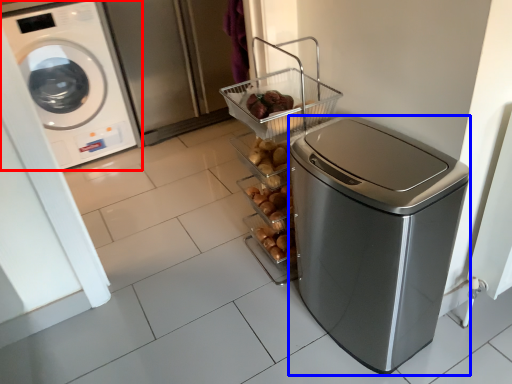
Question: Which of the following is the closest to the observer, washing machine (highlighted by a red box) or dish washer (highlighted by a blue box)?

Choices:
 (A) washing machine
 (B) dish washer

Answer: (B)